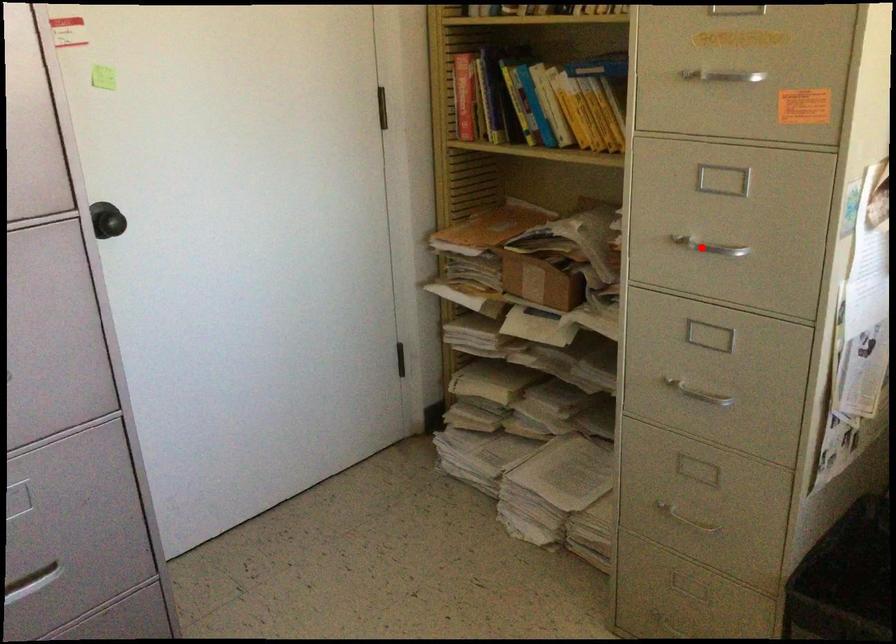
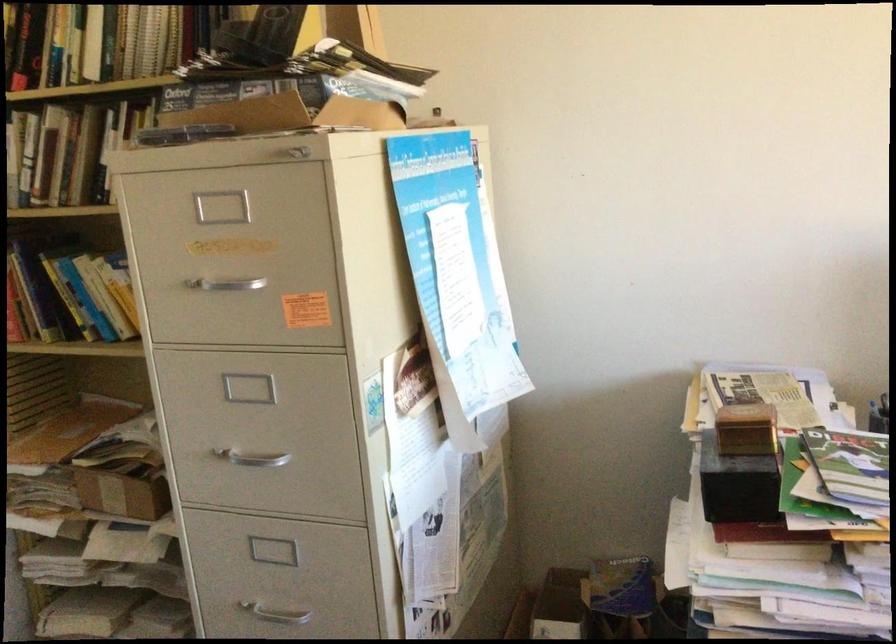
The point at the highlighted location is marked in the first image. Where is the corresponding point in the second image?

(251, 458)